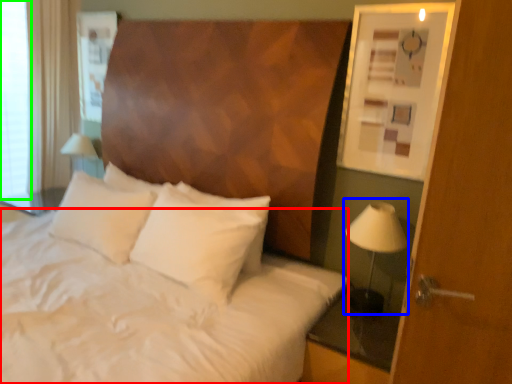
Question: Estimate the real-world distances between objects in this image. Which object is closer to sheet (highlighted by a red box), bedside lamp (highlighted by a blue box) or window screen (highlighted by a green box)?

Choices:
 (A) bedside lamp
 (B) window screen

Answer: (A)